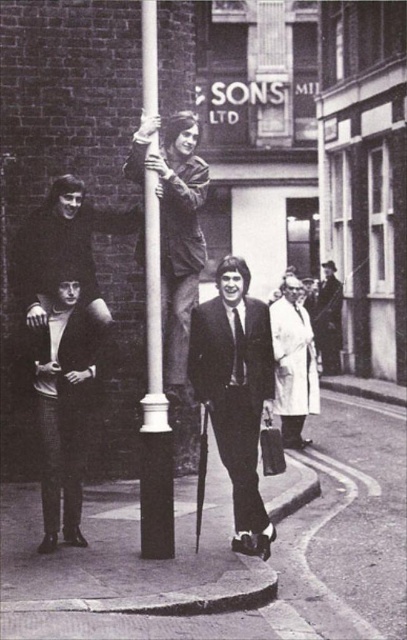
Between matte black suit at center and smooth leather jacket at center, which one has more height?

Standing taller between the two is smooth leather jacket at center.

The width and height of the screenshot is (407, 640). I want to click on matte black suit at center, so click(236, 392).

Locate an element on the screen. Image resolution: width=407 pixels, height=640 pixels. matte black suit at center is located at coordinates (236, 392).

Between leather jacket at upper center and white glossy pole at center, which one is positioned lower?

white glossy pole at center is below.

Does point (199, 125) come behind point (161, 355)?

That is True.

The image size is (407, 640). I want to click on leather jacket at upper center, so click(x=175, y=228).

Does point (168, 372) come farther from viewer compared to point (328, 280)?

No, it is in front of (328, 280).

Does leather jacket at upper center have a lesser height compared to smooth leather jacket at center?

No.

The width and height of the screenshot is (407, 640). I want to click on leather jacket at upper center, so click(x=175, y=228).